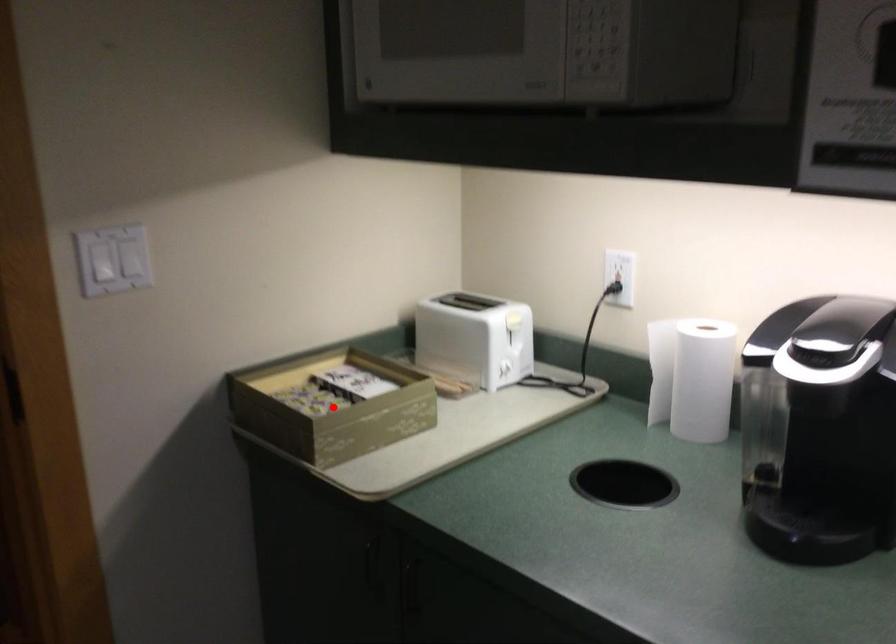
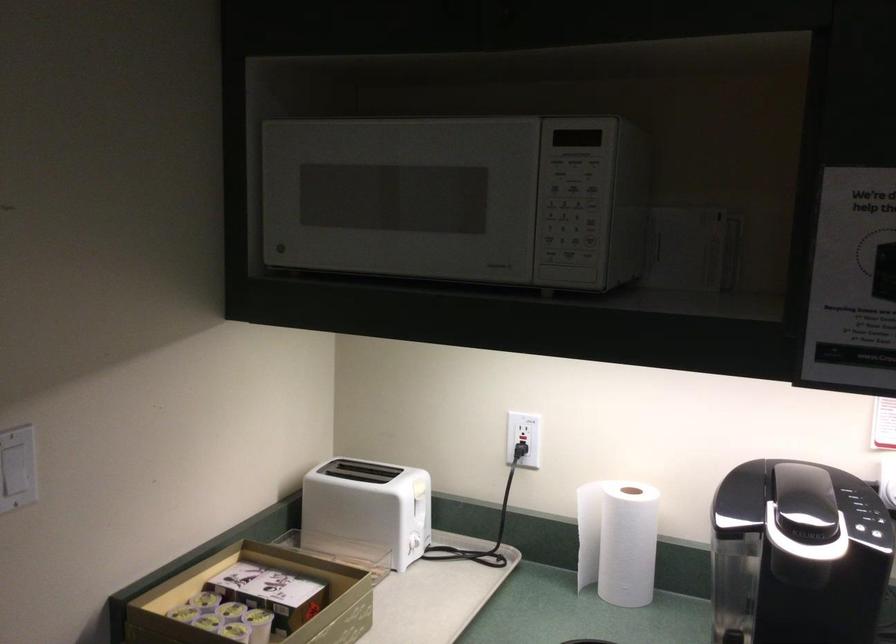
Question: I am providing you with two images of the same scene from different viewpoints. Image1 has a red point marked. In image2, the corresponding 3D location appears at what relative position? Reply with the corresponding letter.

Choices:
 (A) Closer
 (B) Farther

Answer: (A)